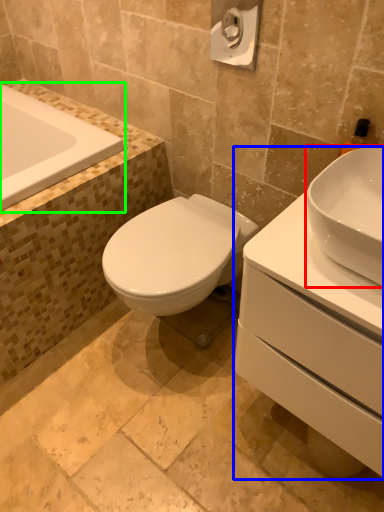
Question: Which is farther away from sink (highlighted by a red box)? porcelain (highlighted by a blue box) or bathtub (highlighted by a green box)?

Choices:
 (A) porcelain
 (B) bathtub

Answer: (B)